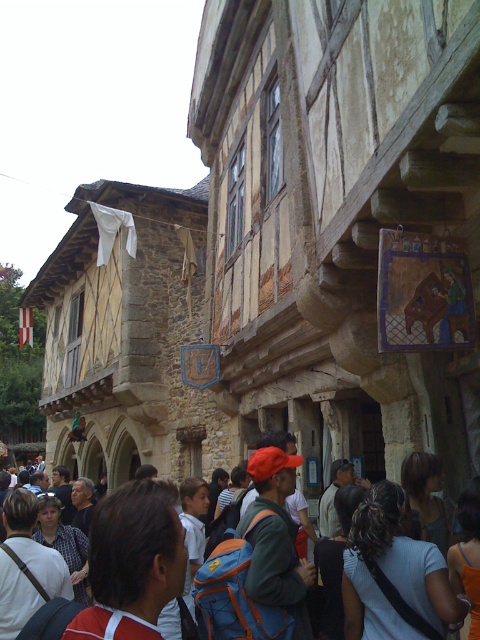
Between curly hair at center and white cotton shirt at center, which one has more height?

Standing taller between the two is curly hair at center.

Does curly hair at center appear on the right side of white cotton shirt at center?

Correct, you'll find curly hair at center to the right of white cotton shirt at center.

Where is `curly hair at center`? This screenshot has height=640, width=480. curly hair at center is located at coordinates (394, 573).

Does dark brown hair at center have a lesser height compared to brown fabric shirt at center?

Incorrect, dark brown hair at center's height does not fall short of brown fabric shirt at center's.

Does dark brown hair at center appear over brown fabric shirt at center?

Incorrect, dark brown hair at center is not positioned above brown fabric shirt at center.

Find the location of `dark brown hair at center`. dark brown hair at center is located at coordinates (336, 561).

Identify the location of dark brown hair at center. This screenshot has height=640, width=480. (336, 561).

Is reddish-brown backpack at center positioned behind white cotton shirt at center?

No, it is in front of white cotton shirt at center.

Is point (111, 584) farther from viewer compared to point (36, 588)?

No, (111, 584) is in front of (36, 588).

Find the location of a particular element. The image size is (480, 640). reddish-brown backpack at center is located at coordinates (132, 563).

The width and height of the screenshot is (480, 640). Find the location of `reddish-brown backpack at center`. reddish-brown backpack at center is located at coordinates (132, 563).